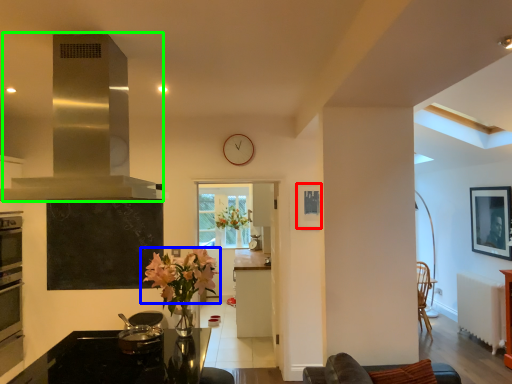
Question: Based on their relative distances, which object is farther from picture frame (highlighted by a red box)? Choose from flower (highlighted by a blue box) and exhaust hood (highlighted by a green box).

Choices:
 (A) flower
 (B) exhaust hood

Answer: (B)